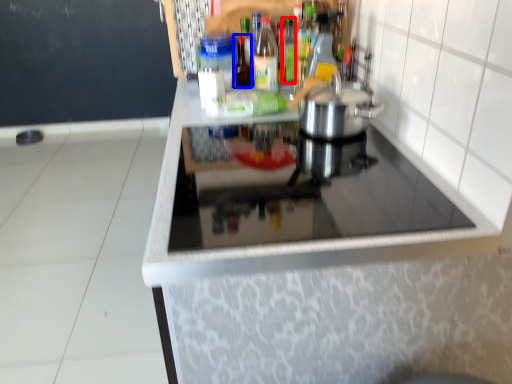
Question: Which of the following is the farthest to the observer, bottle (highlighted by a red box) or bottle (highlighted by a blue box)?

Choices:
 (A) bottle
 (B) bottle

Answer: (A)